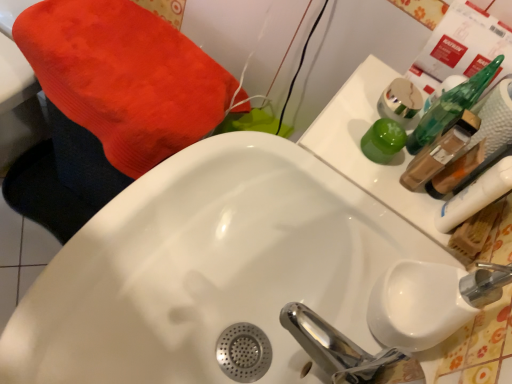
Where is `vacant space in front of translucent plastic mouthwash at right, which appears as the fourth mouthwash when viewed from the top`? vacant space in front of translucent plastic mouthwash at right, which appears as the fourth mouthwash when viewed from the top is located at coordinates (386, 268).